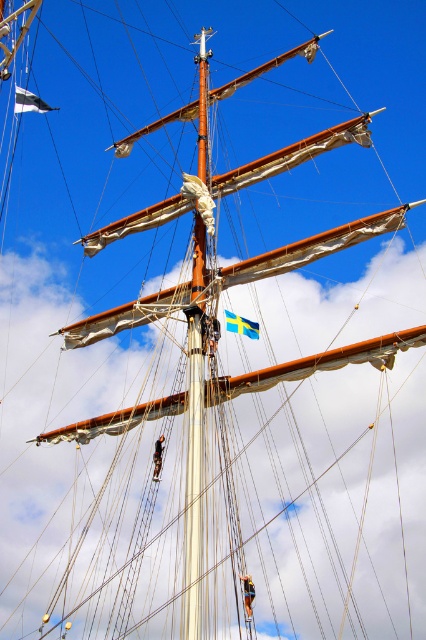
Question: Does white fabric flag at upper left come in front of blue fabric flag at upper center?

Choices:
 (A) no
 (B) yes

Answer: (A)

Question: Does white fabric flag at upper left have a greater width compared to blue fabric flag at upper center?

Choices:
 (A) no
 (B) yes

Answer: (B)

Question: Does white fabric flag at upper left appear on the left side of blue fabric flag at upper center?

Choices:
 (A) no
 (B) yes

Answer: (B)

Question: Which point is farther from the camera taking this photo?

Choices:
 (A) (238, 330)
 (B) (37, 108)

Answer: (B)

Question: Which object is closer to the camera taking this photo?

Choices:
 (A) white fabric flag at upper left
 (B) blue fabric flag at upper center

Answer: (B)

Question: Which point is farther to the camera?

Choices:
 (A) blue fabric flag at upper center
 (B) white fabric flag at upper left

Answer: (B)